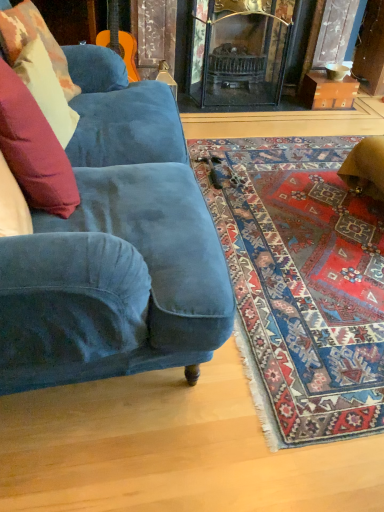
Question: From the image's perspective, is velvet cushion at left, the second pillow in the front-to-back sequence, located above or below brown cardboard box at upper right?

Choices:
 (A) below
 (B) above

Answer: (A)

Question: From their relative heights in the image, would you say velvet cushion at left, the second pillow in the front-to-back sequence, is taller or shorter than brown cardboard box at upper right?

Choices:
 (A) short
 (B) tall

Answer: (B)

Question: Estimate the real-world distances between objects in this image. Which object is farther from the brown cardboard box at upper right?

Choices:
 (A) velvet cushion at left, placed as the first pillow when sorted from back to front
 (B) velvet blue couch at lower left
 (C) velvet cushion at left, the second pillow in the front-to-back sequence
 (D) velvet cushion at left, which appears as the third pillow when viewed from the back
 (E) carpet with intricate patterns at lower right

Answer: (D)

Question: Based on their relative distances, which object is nearer to the velvet cushion at left, the 3th pillow viewed from the front?

Choices:
 (A) brown cardboard box at upper right
 (B) carpet with intricate patterns at lower right
 (C) velvet cushion at left, which appears as the third pillow when viewed from the back
 (D) velvet blue couch at lower left
 (E) velvet cushion at left, which appears as the 2th pillow when viewed from the back

Answer: (E)